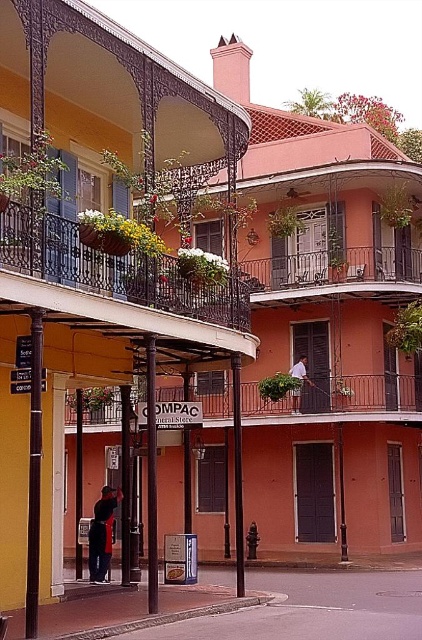
You are a window washer standing on the sidewalk. You need to clean both the matte black wrought iron balcony at upper left and the metallic wrought iron balcony at center. Which balcony will require you to climb a ladder to reach it?

The metallic wrought iron balcony at center requires climbing a ladder because it has a greater height compared to the matte black wrought iron balcony at upper left, which is shorter.

You are standing at the corner of the street and want to walk towards the two points marked in the image. Which point would you reach first, point (343, 608) or point (275, 410)?

Since point (343, 608) is closer to the viewer than point (275, 410), you would reach point (343, 608) first.